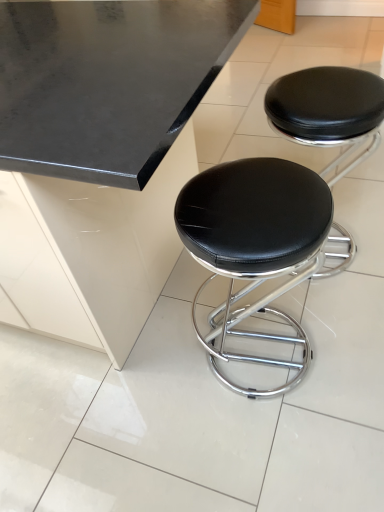
Locate an element on the screen. This screenshot has width=384, height=512. free space above black leather stool at center, the first stool in the left-to-right sequence (from a real-world perspective) is located at coordinates (248, 206).